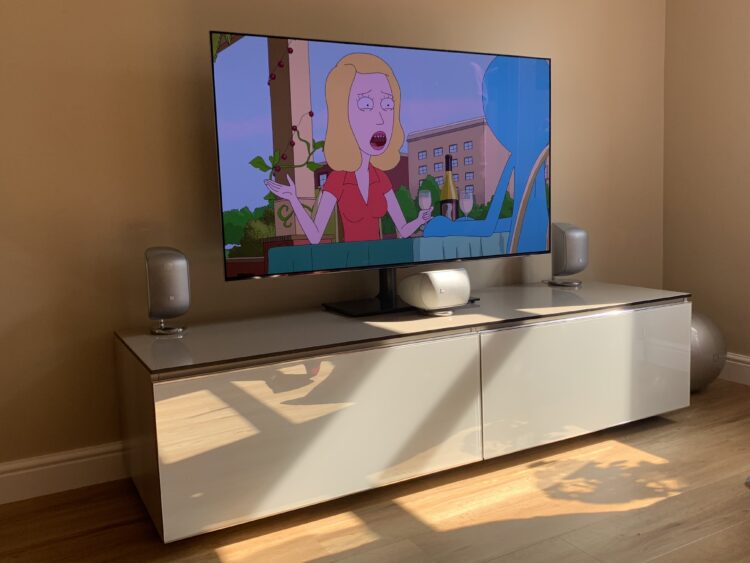
I want to click on white skirting boards, so click(x=76, y=464), click(x=741, y=365).